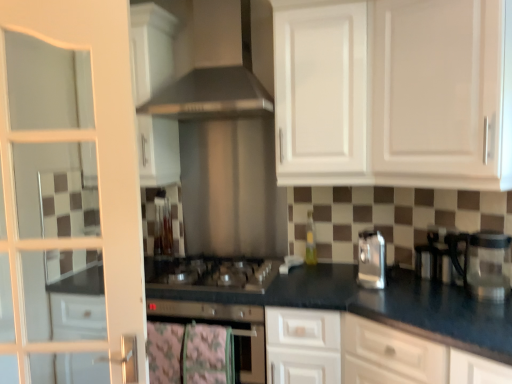
The height and width of the screenshot is (384, 512). Describe the element at coordinates (216, 69) in the screenshot. I see `stainless steel exhaust hood at upper center` at that location.

Describe the element at coordinates (366, 303) in the screenshot. I see `black granite countertop at center` at that location.

The height and width of the screenshot is (384, 512). What do you see at coordinates (394, 93) in the screenshot?
I see `white glossy cabinet at upper center, marked as the 2th cabinetry in a back-to-front arrangement` at bounding box center [394, 93].

In order to face satin silver gas stove at center, should I rotate leftwards or rightwards?

You should rotate left by 5.441 degrees.

You are a GUI agent. You are given a task and a screenshot of the screen. Output one action in this format:
    pyautogui.click(x=<x>, y=<y>)
    Task: Click on the stainless steel exhaust hood at upper center
    
    Given the screenshot: What is the action you would take?
    pyautogui.click(x=216, y=69)

Is satin silver toaster at right positioned beyond the bounds of transparent glass coffee machine at right?

satin silver toaster at right lies outside transparent glass coffee machine at right's area.

Is there a large distance between satin silver toaster at right and transparent glass coffee machine at right?

That's not correct — satin silver toaster at right is a little close to transparent glass coffee machine at right.

Which point is more distant from viewer, (369, 286) or (501, 283)?

Positioned behind is point (369, 286).

From the image's perspective, which one is positioned higher, satin silver toaster at right or transparent glass coffee machine at right?

satin silver toaster at right appears higher in the image.

From the picture: Is there a large distance between transparent glass coffee machine at right and black granite countertop at center?

transparent glass coffee machine at right is near black granite countertop at center, not far away.

Find the location of a particular element. The height and width of the screenshot is (384, 512). countertop behind the transparent glass coffee machine at right is located at coordinates (366, 303).

Looking at the image, does transparent glass coffee machine at right seem bigger or smaller compared to black granite countertop at center?

Clearly, transparent glass coffee machine at right is smaller in size than black granite countertop at center.

From a real-world perspective, relative to black granite countertop at center, is transparent glass coffee machine at right vertically above or below?

transparent glass coffee machine at right is above black granite countertop at center.

Would you consider satin silver toaster at right to be distant from white glossy cabinet at upper center, acting as the first cabinetry starting from the front?

That's not correct — satin silver toaster at right is a little close to white glossy cabinet at upper center, acting as the first cabinetry starting from the front.

From the picture: Is white glossy cabinet at upper center, marked as the 2th cabinetry in a back-to-front arrangement, a part of satin silver toaster at right?

No.

From a real-world perspective, is satin silver toaster at right positioned over white glossy cabinet at upper center, marked as the 2th cabinetry in a back-to-front arrangement, based on gravity?

No, from a real-world perspective, satin silver toaster at right is not above white glossy cabinet at upper center, marked as the 2th cabinetry in a back-to-front arrangement.

Locate an element on the screen. The width and height of the screenshot is (512, 384). kitchen appliance below the white glossy cabinet at upper center, marked as the 2th cabinetry in a back-to-front arrangement (from the image's perspective) is located at coordinates (371, 260).

Which object is positioned more to the right, white glossy cabinet at upper center, which is counted as the 1th cabinetry, starting from the back, or stainless steel exhaust hood at upper center?

Positioned to the right is white glossy cabinet at upper center, which is counted as the 1th cabinetry, starting from the back.

Consider the image. From the image's perspective, is white glossy cabinet at upper center, which is counted as the 1th cabinetry, starting from the back, beneath stainless steel exhaust hood at upper center?

Yes, from the image's perspective, white glossy cabinet at upper center, which is counted as the 1th cabinetry, starting from the back, is below stainless steel exhaust hood at upper center.

Considering the relative positions of white glossy cabinet at upper center, which is counted as the 1th cabinetry, starting from the back, and stainless steel exhaust hood at upper center in the image provided, is white glossy cabinet at upper center, which is counted as the 1th cabinetry, starting from the back, behind stainless steel exhaust hood at upper center?

Yes, white glossy cabinet at upper center, which is counted as the 1th cabinetry, starting from the back, is behind stainless steel exhaust hood at upper center.

Is white glossy cabinet at upper center, the second cabinetry from the front, situated inside stainless steel exhaust hood at upper center or outside?

white glossy cabinet at upper center, the second cabinetry from the front, cannot be found inside stainless steel exhaust hood at upper center.

From the image's perspective, is stainless steel exhaust hood at upper center on white glossy cabinet at upper center, the second cabinetry from the front?

Yes, from the image's perspective, stainless steel exhaust hood at upper center is over white glossy cabinet at upper center, the second cabinetry from the front.

Can white glossy cabinet at upper center, which is counted as the 1th cabinetry, starting from the back, be found inside stainless steel exhaust hood at upper center?

Definitely not — white glossy cabinet at upper center, which is counted as the 1th cabinetry, starting from the back, is not inside stainless steel exhaust hood at upper center.

From a real-world perspective, is stainless steel exhaust hood at upper center beneath white glossy cabinet at upper center, the second cabinetry from the front?

No.

Consider the image. Does stainless steel exhaust hood at upper center appear on the right side of white glossy cabinet at upper center, the second cabinetry from the front?

Incorrect, stainless steel exhaust hood at upper center is not on the right side of white glossy cabinet at upper center, the second cabinetry from the front.

Does stainless steel exhaust hood at upper center come in front of satin silver gas stove at center?

Yes, stainless steel exhaust hood at upper center is in front of satin silver gas stove at center.

Considering the relative positions of stainless steel exhaust hood at upper center and satin silver gas stove at center in the image provided, is stainless steel exhaust hood at upper center to the right of satin silver gas stove at center from the viewer's perspective?

No, stainless steel exhaust hood at upper center is not to the right of satin silver gas stove at center.

Could you tell me if stainless steel exhaust hood at upper center is facing satin silver gas stove at center?

No, stainless steel exhaust hood at upper center does not turn towards satin silver gas stove at center.

From the image's perspective, is stainless steel exhaust hood at upper center on top of satin silver gas stove at center?

Indeed, from the image's perspective, stainless steel exhaust hood at upper center is shown above satin silver gas stove at center.

Where is `the 1st cabinetry directly above the black granite countertop at center (from a real-world perspective)`? the 1st cabinetry directly above the black granite countertop at center (from a real-world perspective) is located at coordinates click(394, 93).

Relative to black granite countertop at center, is white glossy cabinet at upper center, acting as the first cabinetry starting from the front, in front or behind?

white glossy cabinet at upper center, acting as the first cabinetry starting from the front, is in front of black granite countertop at center.

Considering the sizes of white glossy cabinet at upper center, marked as the 2th cabinetry in a back-to-front arrangement, and black granite countertop at center in the image, is white glossy cabinet at upper center, marked as the 2th cabinetry in a back-to-front arrangement, wider or thinner than black granite countertop at center?

white glossy cabinet at upper center, marked as the 2th cabinetry in a back-to-front arrangement, is wider than black granite countertop at center.

Measure the distance from white glossy cabinet at upper center, marked as the 2th cabinetry in a back-to-front arrangement, to black granite countertop at center.

A distance of 29.20 inches exists between white glossy cabinet at upper center, marked as the 2th cabinetry in a back-to-front arrangement, and black granite countertop at center.

This screenshot has height=384, width=512. I want to click on kitchen appliance that appears on the left of transparent glass coffee machine at right, so (371, 260).

At what (x,y) coordinates should I click in order to perform the action: click on coffee machine above the black granite countertop at center (from a real-world perspective). Please return your answer as a coordinate pair (x, y). The height and width of the screenshot is (384, 512). Looking at the image, I should click on (482, 263).

Based on their spatial positions, is white glossy cabinet at upper center, which is counted as the 1th cabinetry, starting from the back, or stainless steel exhaust hood at upper center closer to satin silver oven at center?

Based on the image, white glossy cabinet at upper center, which is counted as the 1th cabinetry, starting from the back, appears to be nearer to satin silver oven at center.

From the image, which object appears to be nearer to white glossy cabinet at upper center, which is counted as the 1th cabinetry, starting from the back, stainless steel exhaust hood at upper center or white glass door at left?

stainless steel exhaust hood at upper center.

Based on the photo, estimate the real-world distances between objects in this image. Which object is further from satin silver gas stove at center, white glass door at left or white glossy cabinet at upper center, marked as the 2th cabinetry in a back-to-front arrangement?

white glossy cabinet at upper center, marked as the 2th cabinetry in a back-to-front arrangement, is further to satin silver gas stove at center.

Looking at the image, which one is located closer to white glass door at left, satin silver oven at center or satin silver gas stove at center?

Among the two, satin silver gas stove at center is located nearer to white glass door at left.

Estimate the real-world distances between objects in this image. Which object is further from black granite countertop at center, satin silver toaster at right or white glass door at left?

white glass door at left is positioned further to the anchor black granite countertop at center.

Estimate the real-world distances between objects in this image. Which object is closer to stainless steel exhaust hood at upper center, satin silver gas stove at center or satin silver oven at center?

Based on the image, satin silver gas stove at center appears to be nearer to stainless steel exhaust hood at upper center.

Estimate the real-world distances between objects in this image. Which object is closer to white glass door at left, stainless steel exhaust hood at upper center or transparent glass coffee machine at right?

stainless steel exhaust hood at upper center is positioned closer to the anchor white glass door at left.

Estimate the real-world distances between objects in this image. Which object is further from satin silver oven at center, black granite countertop at center or white glass door at left?

Among the two, white glass door at left is located further to satin silver oven at center.

Where is `cabinetry between white glossy cabinet at upper center, the second cabinetry from the front, and satin silver gas stove at center from top to bottom`? The image size is (512, 384). cabinetry between white glossy cabinet at upper center, the second cabinetry from the front, and satin silver gas stove at center from top to bottom is located at coordinates (394, 93).

What are the coordinates of `cabinetry that lies between white glossy cabinet at upper center, which is counted as the 1th cabinetry, starting from the back, and transparent glass coffee machine at right from top to bottom` in the screenshot? It's located at (394, 93).

Locate an element on the screen. The height and width of the screenshot is (384, 512). coffee machine between white glossy cabinet at upper center, which is counted as the 1th cabinetry, starting from the back, and black granite countertop at center from top to bottom is located at coordinates (482, 263).

The image size is (512, 384). I want to click on countertop between white glossy cabinet at upper center, marked as the 2th cabinetry in a back-to-front arrangement, and satin silver oven at center, in the vertical direction, so click(x=366, y=303).